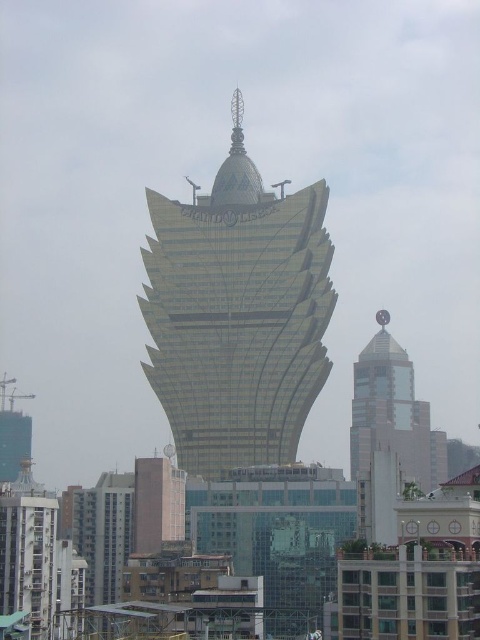
Can you confirm if gold metallic tower at center is positioned below glassy reflective tower at center?

No, gold metallic tower at center is not below glassy reflective tower at center.

Does gold metallic tower at center have a larger size compared to glassy reflective tower at center?

Indeed, gold metallic tower at center has a larger size compared to glassy reflective tower at center.

Who is more distant from viewer, (190, 449) or (360, 445)?

The point (360, 445) is behind.

You are a GUI agent. You are given a task and a screenshot of the screen. Output one action in this format:
    pyautogui.click(x=<x>, y=<y>)
    Task: Click on the gold metallic tower at center
    
    Given the screenshot: What is the action you would take?
    pyautogui.click(x=237, y=314)